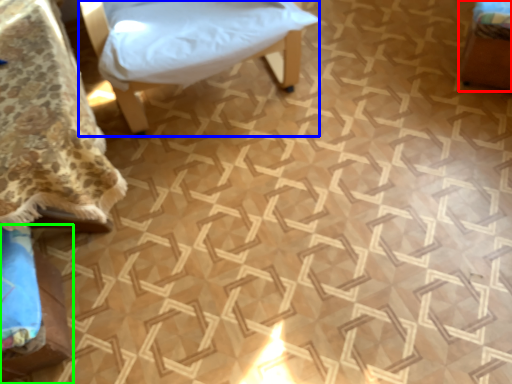
Question: Which is nearer to the furniture (highlighted by a red box)? furniture (highlighted by a blue box) or furniture (highlighted by a green box).

Choices:
 (A) furniture
 (B) furniture

Answer: (A)